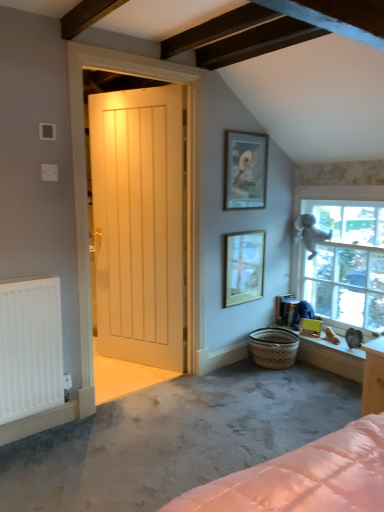
Locate an element on the screen. The image size is (384, 512). vacant area situated below white matte radiator at lower left (from a real-world perspective) is located at coordinates (36, 432).